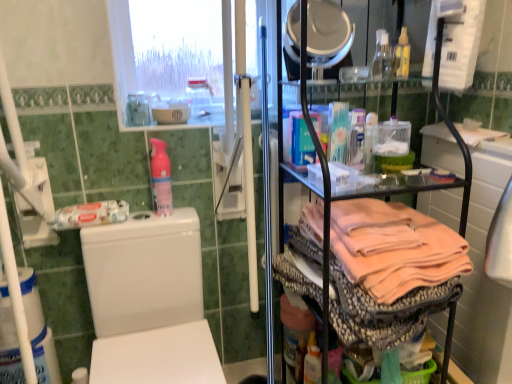
Question: Can you confirm if transparent glass bottle at upper right, which appears as the fourth bottle when viewed from the left, is wider than white glossy mirror at upper center?

Choices:
 (A) no
 (B) yes

Answer: (A)

Question: Is transparent glass bottle at upper right, which appears as the fourth bottle when viewed from the left, thinner than white glossy mirror at upper center?

Choices:
 (A) yes
 (B) no

Answer: (A)

Question: From a real-world perspective, does transparent glass bottle at upper right, marked as the 2th bottle in a right-to-left arrangement, sit lower than white glossy mirror at upper center?

Choices:
 (A) yes
 (B) no

Answer: (A)

Question: Is transparent glass bottle at upper right, which appears as the fourth bottle when viewed from the left, positioned behind white glossy mirror at upper center?

Choices:
 (A) yes
 (B) no

Answer: (A)

Question: From the image's perspective, would you say transparent glass bottle at upper right, marked as the 2th bottle in a right-to-left arrangement, is positioned over white glossy mirror at upper center?

Choices:
 (A) yes
 (B) no

Answer: (A)

Question: Considering the relative positions of transparent glass bottle at upper right, marked as the 2th bottle in a right-to-left arrangement, and white glossy mirror at upper center in the image provided, is transparent glass bottle at upper right, marked as the 2th bottle in a right-to-left arrangement, to the right of white glossy mirror at upper center from the viewer's perspective?

Choices:
 (A) no
 (B) yes

Answer: (B)

Question: Is white mesh screen at upper center oriented towards white glossy toilet at left?

Choices:
 (A) no
 (B) yes

Answer: (A)

Question: Considering the relative sizes of white mesh screen at upper center and white glossy toilet at left in the image provided, is white mesh screen at upper center wider than white glossy toilet at left?

Choices:
 (A) yes
 (B) no

Answer: (B)

Question: Is white mesh screen at upper center positioned with its back to white glossy toilet at left?

Choices:
 (A) yes
 (B) no

Answer: (B)

Question: Is white mesh screen at upper center thinner than white glossy toilet at left?

Choices:
 (A) yes
 (B) no

Answer: (A)

Question: Is white mesh screen at upper center outside of white glossy toilet at left?

Choices:
 (A) no
 (B) yes

Answer: (B)

Question: Is white mesh screen at upper center positioned behind white glossy toilet at left?

Choices:
 (A) no
 (B) yes

Answer: (B)

Question: From the image's perspective, is white glossy mirror at upper center located above white glossy bowl at upper center?

Choices:
 (A) no
 (B) yes

Answer: (B)